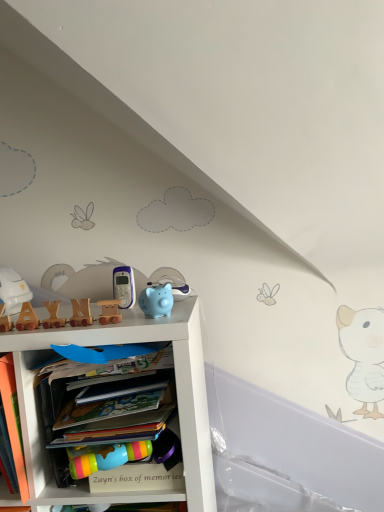
Find the location of `vacant space situated on the left part of matte blue piggy bank at center, acting as the seventh toy starting from the left`. vacant space situated on the left part of matte blue piggy bank at center, acting as the seventh toy starting from the left is located at coordinates point(107,321).